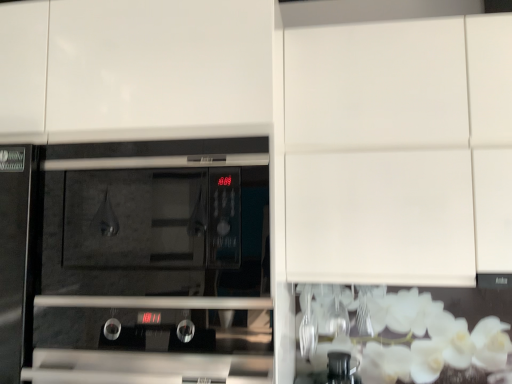
The image size is (512, 384). Describe the element at coordinates (151, 262) in the screenshot. I see `black glass oven at center` at that location.

I want to click on black glass oven at center, so click(x=151, y=262).

In the scene shown: What is the approximate width of black glass oven at center?

28.00 centimeters.

Describe the element at coordinates (399, 151) in the screenshot. I see `white matte cabinet at upper center` at that location.

At what (x,y) coordinates should I click in order to perform the action: click on white matte cabinet at upper center. Please return your answer as a coordinate pair (x, y). The height and width of the screenshot is (384, 512). Looking at the image, I should click on [399, 151].

At what (x,y) coordinates should I click in order to perform the action: click on black glass oven at center. Please return your answer as a coordinate pair (x, y). The width and height of the screenshot is (512, 384). Looking at the image, I should click on (151, 262).

Between black glass oven at center and white matte cabinet at upper center, which one appears on the right side from the viewer's perspective?

white matte cabinet at upper center.

Is black glass oven at center closer to the viewer compared to white matte cabinet at upper center?

Yes, black glass oven at center is closer to the camera.

Is point (139, 364) closer or farther from the camera than point (453, 144)?

Point (139, 364).

From the image's perspective, does black glass oven at center appear higher than white matte cabinet at upper center?

No.

From a real-world perspective, which object stands above the other?

white matte cabinet at upper center.

Can you confirm if black glass oven at center is wider than white matte cabinet at upper center?

Incorrect, the width of black glass oven at center does not surpass that of white matte cabinet at upper center.

Who is taller, black glass oven at center or white matte cabinet at upper center?

white matte cabinet at upper center is taller.

Considering the relative sizes of black glass oven at center and white matte cabinet at upper center in the image provided, is black glass oven at center bigger than white matte cabinet at upper center?

Incorrect, black glass oven at center is not larger than white matte cabinet at upper center.

Would you say black glass oven at center is outside white matte cabinet at upper center?

Yes, black glass oven at center is not within white matte cabinet at upper center.

Is black glass oven at center next to white matte cabinet at upper center and touching it?

No.

Is white matte cabinet at upper center at the back of black glass oven at center?

That's not correct — black glass oven at center is not looking away from white matte cabinet at upper center.

Locate an element on the screen. The height and width of the screenshot is (384, 512). cabinetry above the black glass oven at center (from a real-world perspective) is located at coordinates (399, 151).

Considering the relative positions of white matte cabinet at upper center and black glass oven at center in the image provided, is white matte cabinet at upper center to the left of black glass oven at center from the viewer's perspective?

No.

Is the depth of white matte cabinet at upper center less than that of black glass oven at center?

No, the depth of white matte cabinet at upper center is greater than that of black glass oven at center.

Considering the positions of point (451, 266) and point (44, 345), is point (451, 266) closer or farther from the camera than point (44, 345)?

Point (451, 266) is positioned farther from the camera compared to point (44, 345).

From the image's perspective, which is above, white matte cabinet at upper center or black glass oven at center?

white matte cabinet at upper center appears higher in the image.

From a real-world perspective, which is physically below, white matte cabinet at upper center or black glass oven at center?

From a 3D spatial view, black glass oven at center is below.

Which object is wider, white matte cabinet at upper center or black glass oven at center?

white matte cabinet at upper center.

Does white matte cabinet at upper center have a greater height compared to black glass oven at center?

Correct, white matte cabinet at upper center is much taller as black glass oven at center.

Is white matte cabinet at upper center bigger than black glass oven at center?

Correct, white matte cabinet at upper center is larger in size than black glass oven at center.

From the picture: Is white matte cabinet at upper center not inside black glass oven at center?

Yes, white matte cabinet at upper center is outside of black glass oven at center.

Is white matte cabinet at upper center touching black glass oven at center?

white matte cabinet at upper center is not next to black glass oven at center, and they're not touching.

Could you tell me if white matte cabinet at upper center is turned towards black glass oven at center?

No, white matte cabinet at upper center is not aimed at black glass oven at center.

What's the angular difference between white matte cabinet at upper center and black glass oven at center's facing directions?

The angle between the facing direction of white matte cabinet at upper center and the facing direction of black glass oven at center is 0.733 degrees.

The height and width of the screenshot is (384, 512). Identify the location of oven to the left of white matte cabinet at upper center. (151, 262).

Locate an element on the screen. This screenshot has height=384, width=512. oven below the white matte cabinet at upper center (from the image's perspective) is located at coordinates pos(151,262).

Image resolution: width=512 pixels, height=384 pixels. In order to click on cabinetry above the black glass oven at center (from a real-world perspective) in this screenshot , I will do `click(399, 151)`.